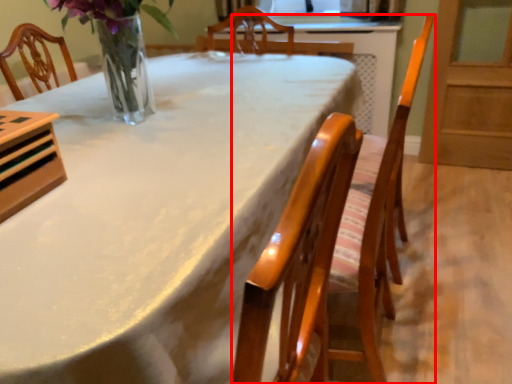
Question: From the image's perspective, where is chair (annotated by the red box) located in relation to table in the image?

Choices:
 (A) below
 (B) above

Answer: (B)